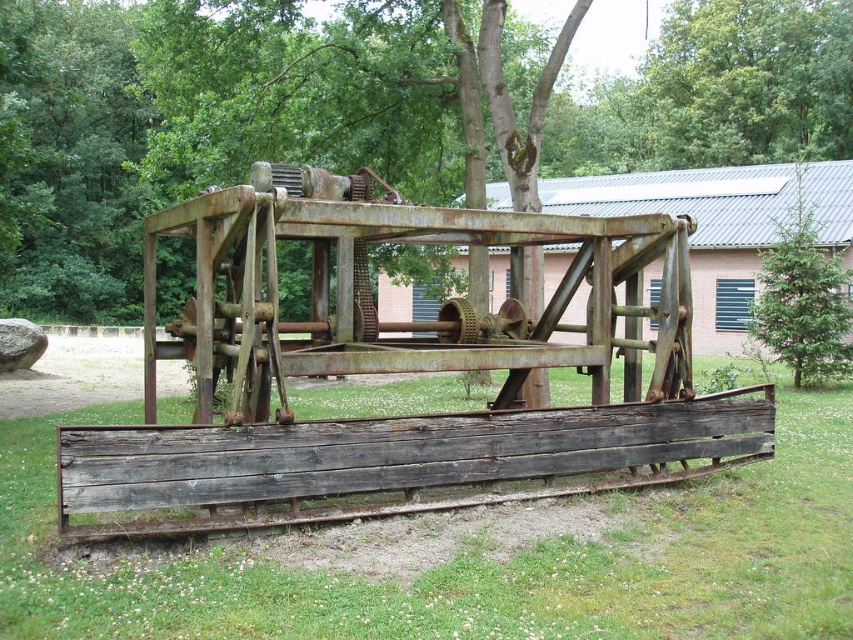
Consider the image. You are a park visitor standing in front of the industrial structure. You notice the weathered wood at center and the green leafy tree at upper center. Which object is shorter?

The weathered wood at center is shorter than the green leafy tree at upper center.

You are a park visitor standing near the old industrial structure. You notice the weathered wood at center and the green leafy tree at upper center. Which object is positioned higher in the image?

The green leafy tree at upper center is positioned higher in the image as it is located above the weathered wood at center.